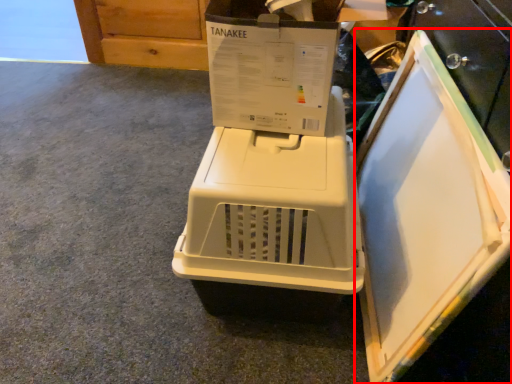
Question: From the image's perspective, where is appliance (annotated by the red box) located relative to home appliance?

Choices:
 (A) above
 (B) below

Answer: (A)